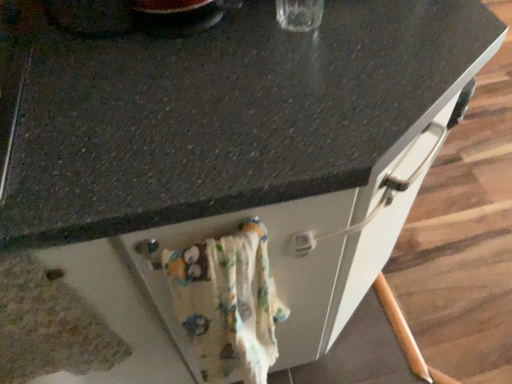
The image size is (512, 384). I want to click on white fabric towel at lower center, so click(x=284, y=261).

What do you see at coordinates (284, 261) in the screenshot? I see `white fabric towel at lower center` at bounding box center [284, 261].

At what (x,y) coordinates should I click in order to perform the action: click on white fabric towel at lower center. Please return your answer as a coordinate pair (x, y). Looking at the image, I should click on (284, 261).